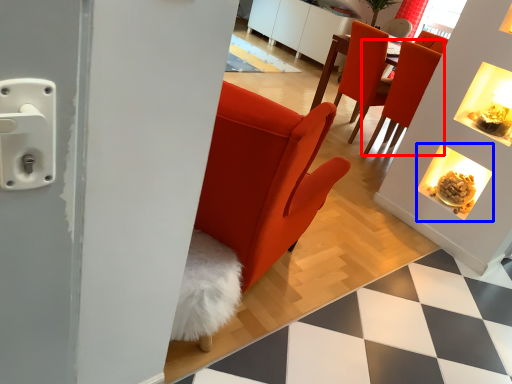
Question: Which of the following is the farthest to the observer, chair (highlighted by a red box) or fireplace (highlighted by a blue box)?

Choices:
 (A) chair
 (B) fireplace

Answer: (A)